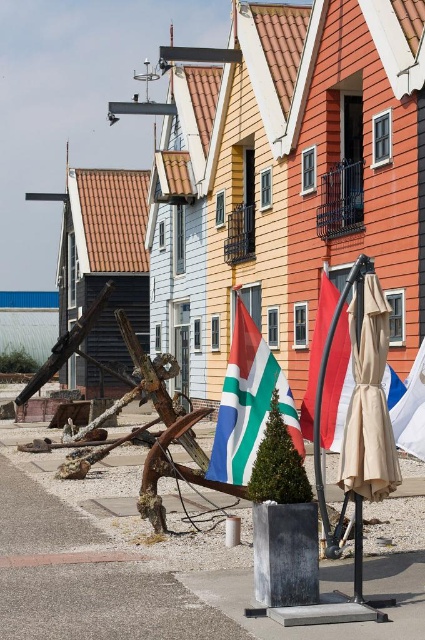
Question: Which is nearer to the blue fabric flag at center?

Choices:
 (A) beige fabric umbrella at center
 (B) red fabric flag at center
 (C) brown tile roof at upper left

Answer: (B)

Question: Is brown tile roof at upper left in front of green and white striped flag at center?

Choices:
 (A) yes
 (B) no

Answer: (B)

Question: Which object is positioned closest to the beige fabric umbrella at center?

Choices:
 (A) red fabric flag at center
 (B) blue fabric flag at center

Answer: (A)

Question: Is green and white striped flag at center to the left of blue fabric flag at center from the viewer's perspective?

Choices:
 (A) no
 (B) yes

Answer: (B)

Question: Is brown tile roof at upper left positioned at the back of beige fabric umbrella at center?

Choices:
 (A) yes
 (B) no

Answer: (A)

Question: Which of the following is the farthest from the observer?

Choices:
 (A) (402, 410)
 (B) (102, 266)
 (C) (235, 336)

Answer: (B)